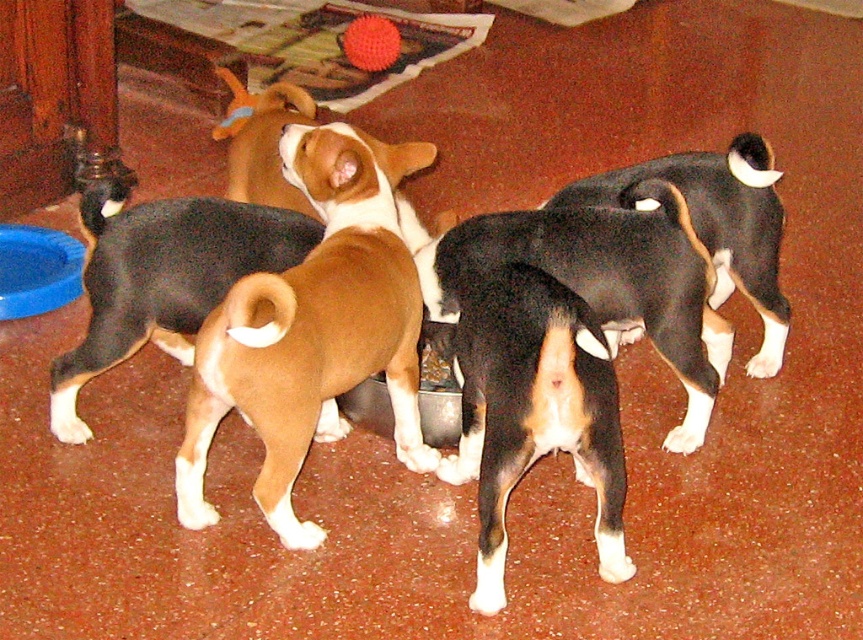
You are standing in the kitchen where the four dogs are eating. You need to place a treat between the two points, point (98, 284) and point (224, 124). Which point should the treat be closer to so it is in front of the dogs?

The treat should be placed closer to point (98, 284) because it is in front of point (224, 124), meaning the dogs would see it first in that direction.

You are a pet owner who wants to ensure each dog has enough space to eat comfortably. Given that the brown and white fur at center is wider than the brown matte dog at center, which dog requires a larger feeding area to accommodate its size?

The brown and white fur at center requires a larger feeding area because its width surpasses that of the brown matte dog at center.